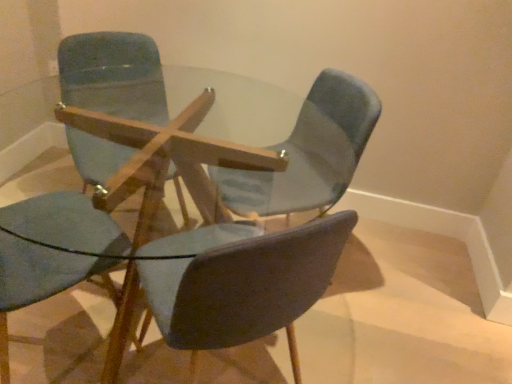
This screenshot has width=512, height=384. Find the location of `vacant point to the right of light blue fabric chair at center, which is the first chair from right to left`. vacant point to the right of light blue fabric chair at center, which is the first chair from right to left is located at coordinates [x=378, y=296].